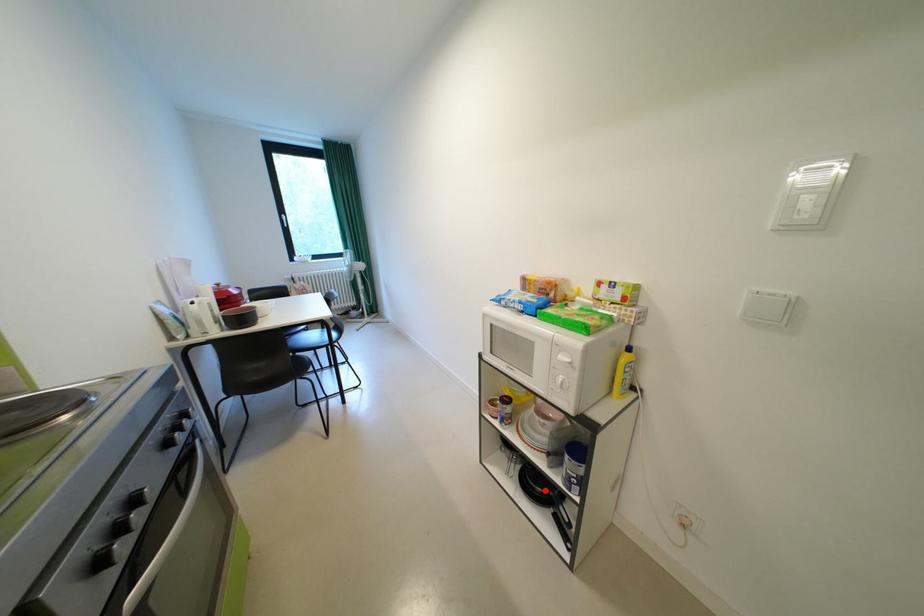
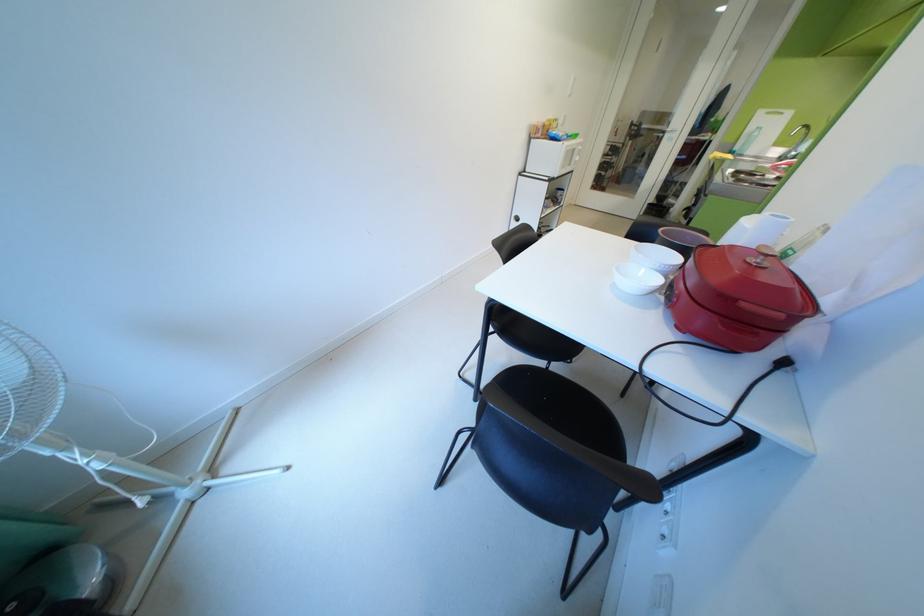
Question: I am providing you with two images of the same scene from different viewpoints. A red point is marked on the first image. At the location where the point appears in image 1, is it still visible in image 2?

Choices:
 (A) Yes
 (B) No

Answer: (B)